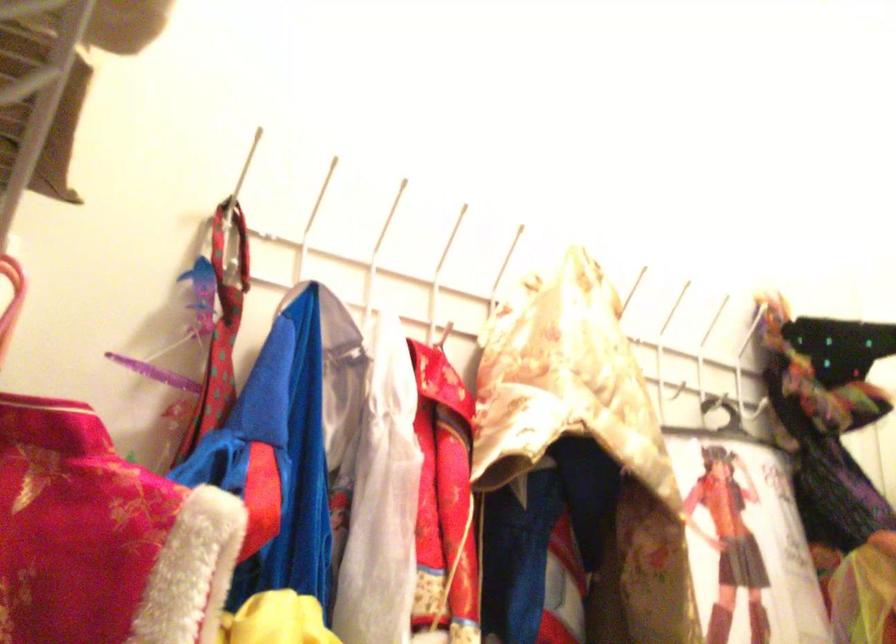
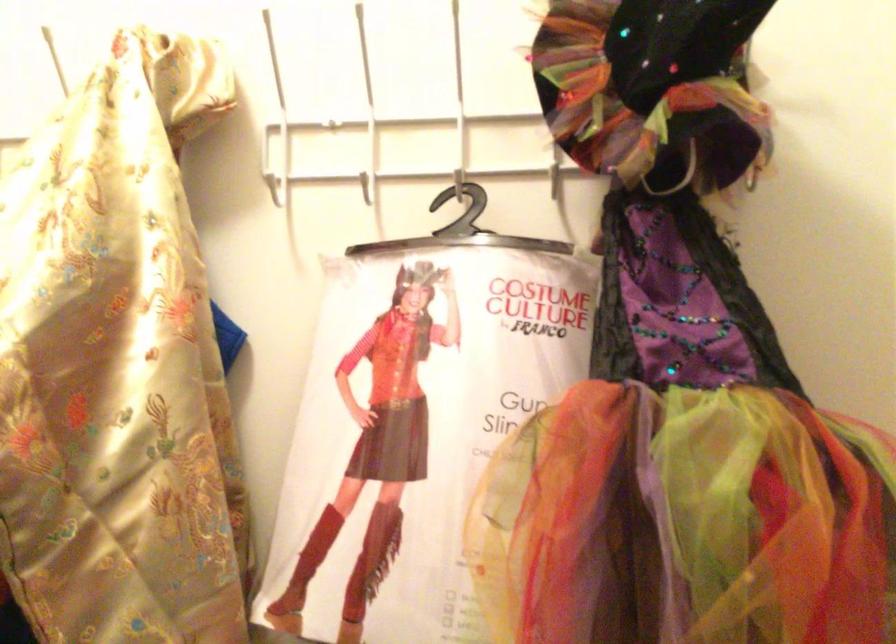
The point at (x=753, y=401) is marked in the first image. Where is the corresponding point in the second image?

(554, 180)